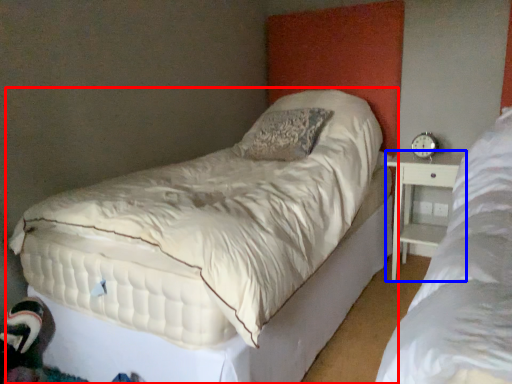
Question: Which object is further to the camera taking this photo, bed (highlighted by a red box) or nightstand (highlighted by a blue box)?

Choices:
 (A) bed
 (B) nightstand

Answer: (B)